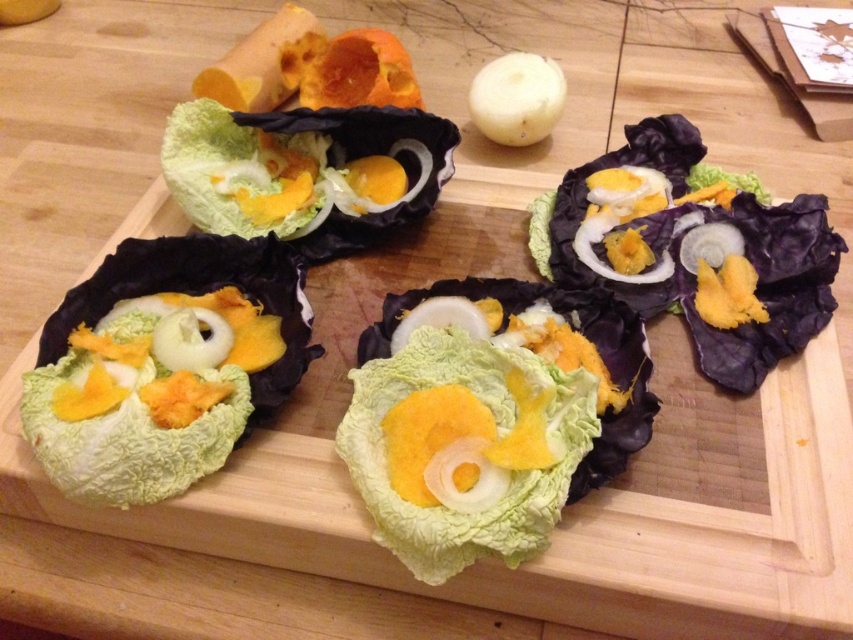
Question: Is green leafy lettuce at lower left wider than green leafy cabbage at upper left?

Choices:
 (A) no
 (B) yes

Answer: (B)

Question: Is purple matte cabbage leaf at upper right bigger than green leafy lettuce at center?

Choices:
 (A) no
 (B) yes

Answer: (B)

Question: Which object is the closest to the green leafy lettuce at center?

Choices:
 (A) green leafy lettuce at lower left
 (B) green leafy cabbage at upper left
 (C) purple matte cabbage leaf at upper right

Answer: (A)

Question: Can you confirm if purple matte cabbage leaf at upper right is bigger than green leafy lettuce at center?

Choices:
 (A) yes
 (B) no

Answer: (A)

Question: Which of the following is the closest to the observer?

Choices:
 (A) (93, 380)
 (B) (241, 172)
 (C) (650, 241)

Answer: (A)

Question: Among these points, which one is farthest from the camera?

Choices:
 (A) (259, 186)
 (B) (196, 461)

Answer: (A)